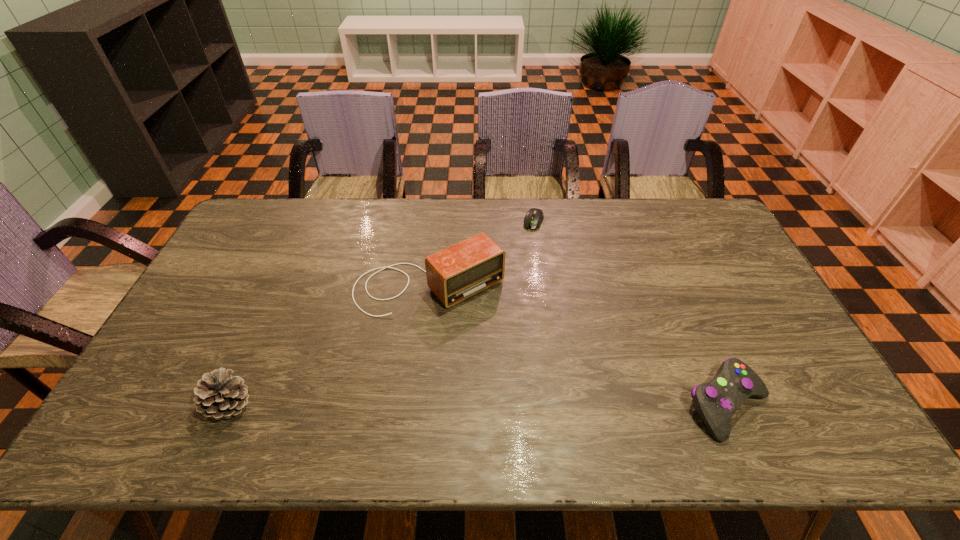
What are the coordinates of `free region located on the front-facing side of the radio receiver` in the screenshot? It's located at (485, 327).

I want to click on vacant point located on the front-facing side of the radio receiver, so point(527,375).

The width and height of the screenshot is (960, 540). I want to click on vacant space located 0.270m on the wheel side of the farthest object, so click(509, 282).

This screenshot has width=960, height=540. What are the coordinates of `blank space located 0.390m on the wheel side of the farthest object` in the screenshot? It's located at (497, 309).

I want to click on vacant space situated on the wheel side of the farthest object, so click(x=504, y=293).

What are the coordinates of `object at the far edge` in the screenshot? It's located at (534, 217).

The image size is (960, 540). What are the coordinates of `pinecone at the near edge` in the screenshot? It's located at (220, 395).

You are a GUI agent. You are given a task and a screenshot of the screen. Output one action in this format:
    pyautogui.click(x=<x>, y=<y>)
    Task: Click on the control at the near edge
    This screenshot has width=960, height=540.
    Given the screenshot: What is the action you would take?
    pyautogui.click(x=716, y=401)

In order to click on object located in the right edge section of the desktop in this screenshot , I will do `click(716, 401)`.

Locate an element on the screen. object at the near right corner is located at coordinates (716, 401).